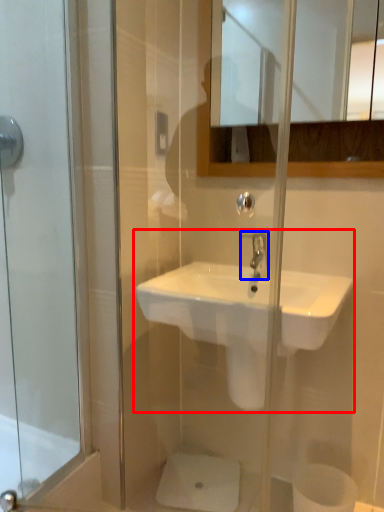
Question: Which of the following is the farthest to the observer, sink (highlighted by a red box) or tap (highlighted by a blue box)?

Choices:
 (A) sink
 (B) tap

Answer: (B)